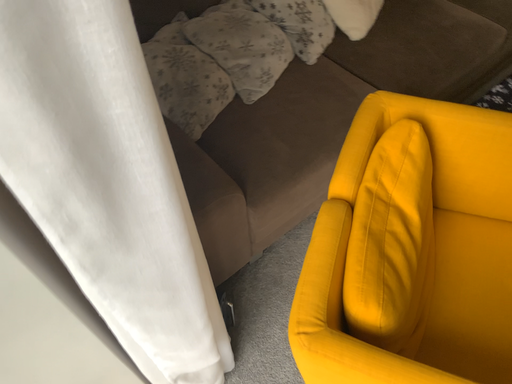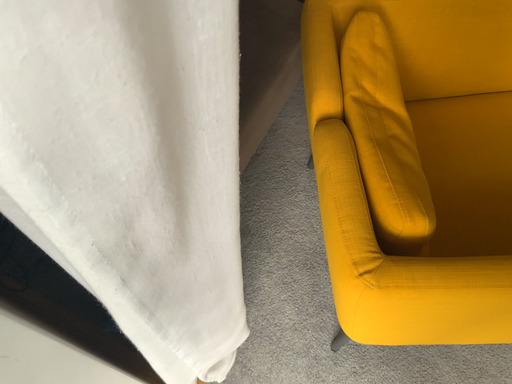
Question: How did the camera likely rotate when shooting the video?

Choices:
 (A) rotated right
 (B) rotated left

Answer: (A)